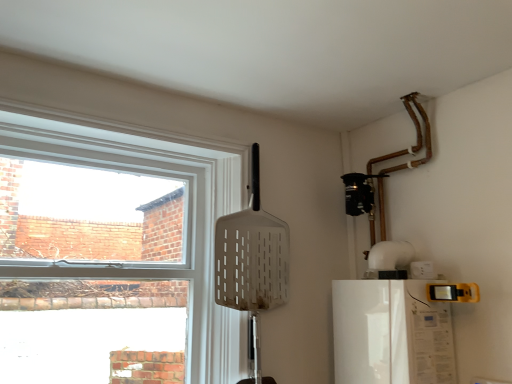
This screenshot has height=384, width=512. I want to click on white glossy refrigerator at lower right, so click(390, 333).

Describe the element at coordinates (390, 333) in the screenshot. I see `white glossy refrigerator at lower right` at that location.

Where is `clear glass window at upper left`? This screenshot has height=384, width=512. clear glass window at upper left is located at coordinates (184, 215).

Describe the element at coordinates (184, 215) in the screenshot. I see `clear glass window at upper left` at that location.

Image resolution: width=512 pixels, height=384 pixels. Identify the location of white glossy refrigerator at lower right. (390, 333).

Based on the photo, is white glossy refrigerator at lower right at the left side of clear glass window at upper left?

Incorrect, white glossy refrigerator at lower right is not on the left side of clear glass window at upper left.

Who is more distant, white glossy refrigerator at lower right or clear glass window at upper left?

white glossy refrigerator at lower right.

Which point is more distant from viewer, (432, 354) or (207, 191)?

The point (207, 191) is farther.

From the image's perspective, who appears lower, white glossy refrigerator at lower right or clear glass window at upper left?

white glossy refrigerator at lower right, from the image's perspective.

From a real-world perspective, is white glossy refrigerator at lower right physically located above or below clear glass window at upper left?

In terms of real-world spatial position, white glossy refrigerator at lower right is below clear glass window at upper left.

Can you confirm if white glossy refrigerator at lower right is thinner than clear glass window at upper left?

No, white glossy refrigerator at lower right is not thinner than clear glass window at upper left.

Considering the relative sizes of white glossy refrigerator at lower right and clear glass window at upper left in the image provided, is white glossy refrigerator at lower right taller than clear glass window at upper left?

No.

Considering the relative sizes of white glossy refrigerator at lower right and clear glass window at upper left in the image provided, is white glossy refrigerator at lower right smaller than clear glass window at upper left?

Yes.

Is white glossy refrigerator at lower right positioned beyond the bounds of clear glass window at upper left?

Yes, white glossy refrigerator at lower right is located beyond the bounds of clear glass window at upper left.

Is white glossy refrigerator at lower right directly adjacent to clear glass window at upper left?

No, white glossy refrigerator at lower right is not beside clear glass window at upper left.

Is white glossy refrigerator at lower right oriented towards clear glass window at upper left?

Yes, white glossy refrigerator at lower right is aimed at clear glass window at upper left.

Where is `appliance that is behind the clear glass window at upper left`? appliance that is behind the clear glass window at upper left is located at coordinates (390, 333).

Based on the photo, which object is positioned more to the right, clear glass window at upper left or white glossy refrigerator at lower right?

white glossy refrigerator at lower right is more to the right.

Is the depth of clear glass window at upper left greater than that of white glossy refrigerator at lower right?

No, clear glass window at upper left is closer to the camera.

Which is behind, point (239, 149) or point (362, 325)?

The point (239, 149) is more distant.

From the image's perspective, relative to white glossy refrigerator at lower right, is clear glass window at upper left above or below?

clear glass window at upper left is above white glossy refrigerator at lower right.

From a real-world perspective, is clear glass window at upper left positioned over white glossy refrigerator at lower right based on gravity?

Yes, from a real-world perspective, clear glass window at upper left is over white glossy refrigerator at lower right

In terms of width, does clear glass window at upper left look wider or thinner when compared to white glossy refrigerator at lower right?

Considering their sizes, clear glass window at upper left looks slimmer than white glossy refrigerator at lower right.

Does clear glass window at upper left have a lesser height compared to white glossy refrigerator at lower right?

Incorrect, the height of clear glass window at upper left does not fall short of that of white glossy refrigerator at lower right.

Between clear glass window at upper left and white glossy refrigerator at lower right, which one has smaller size?

Smaller between the two is white glossy refrigerator at lower right.

Is clear glass window at upper left inside the boundaries of white glossy refrigerator at lower right, or outside?

clear glass window at upper left is outside white glossy refrigerator at lower right.

Is clear glass window at upper left far from white glossy refrigerator at lower right?

No, clear glass window at upper left is not far from white glossy refrigerator at lower right.

Is clear glass window at upper left turned away from white glossy refrigerator at lower right?

No, white glossy refrigerator at lower right is not at the back of clear glass window at upper left.

How many degrees apart are the facing directions of clear glass window at upper left and white glossy refrigerator at lower right?

They differ by 88.4 degrees in their facing directions.

Image resolution: width=512 pixels, height=384 pixels. I want to click on appliance on the right of the clear glass window at upper left, so click(x=390, y=333).

Locate an element on the screen. window on the left of white glossy refrigerator at lower right is located at coordinates (184, 215).

Where is `appliance behind the clear glass window at upper left`? appliance behind the clear glass window at upper left is located at coordinates (390, 333).